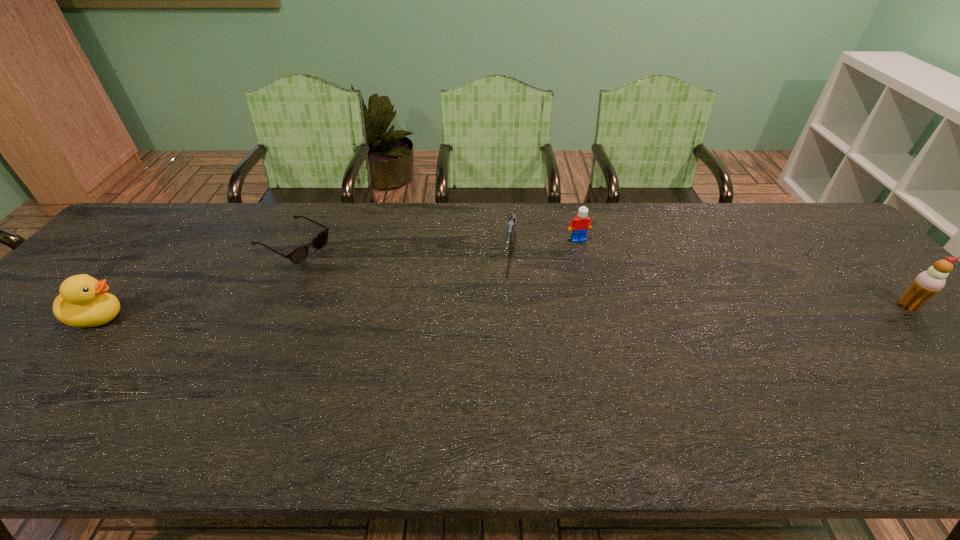
Locate an element on the screen. This screenshot has height=540, width=960. free spot on the desktop that is between the leftmost object and the rightmost object and is positioned at the barrel of the third object from right to left is located at coordinates (499, 311).

Where is `free space on the desktop that is between the duck and the rightmost object and is positioned on the front lenses of the second object from left to right`? free space on the desktop that is between the duck and the rightmost object and is positioned on the front lenses of the second object from left to right is located at coordinates (425, 312).

The image size is (960, 540). In order to click on vacant space on the desktop that is between the leftmost object and the tallest object and is positioned on the face of the fourth object from left to right in this screenshot , I will do `click(612, 309)`.